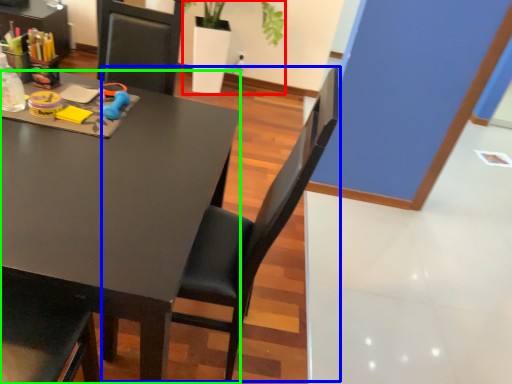
Question: Considering the real-world distances, which object is farthest from houseplant (highlighted by a red box)? chair (highlighted by a blue box) or desk (highlighted by a green box)?

Choices:
 (A) chair
 (B) desk

Answer: (A)